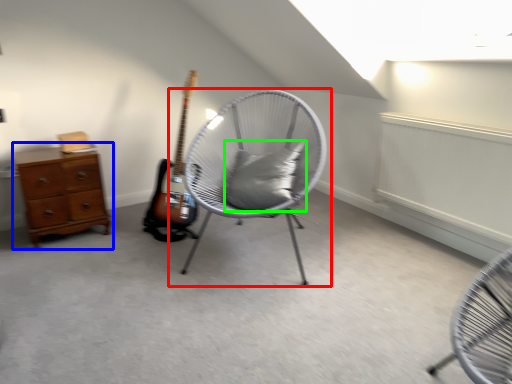
Question: Which object is the farthest from chair (highlighted by a red box)? Choose among these: chest of drawers (highlighted by a blue box) or pillow (highlighted by a green box).

Choices:
 (A) chest of drawers
 (B) pillow

Answer: (A)